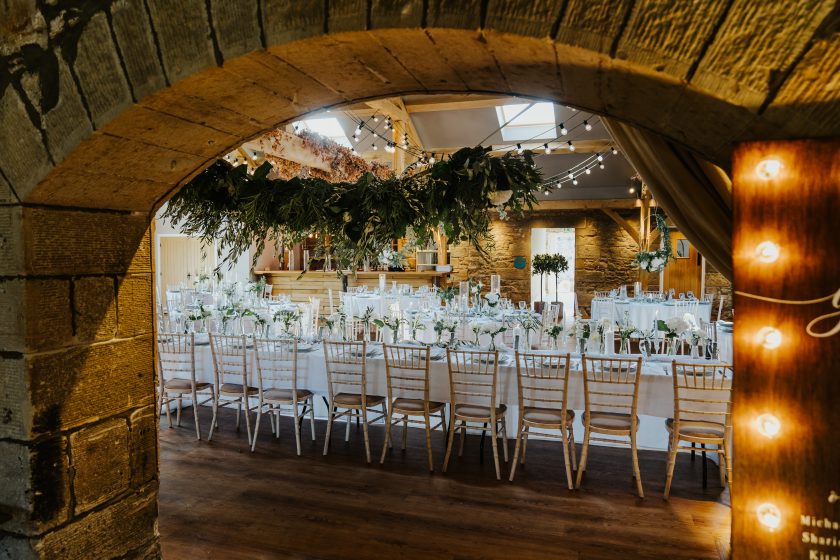
I want to click on table decorations, so click(465, 326).